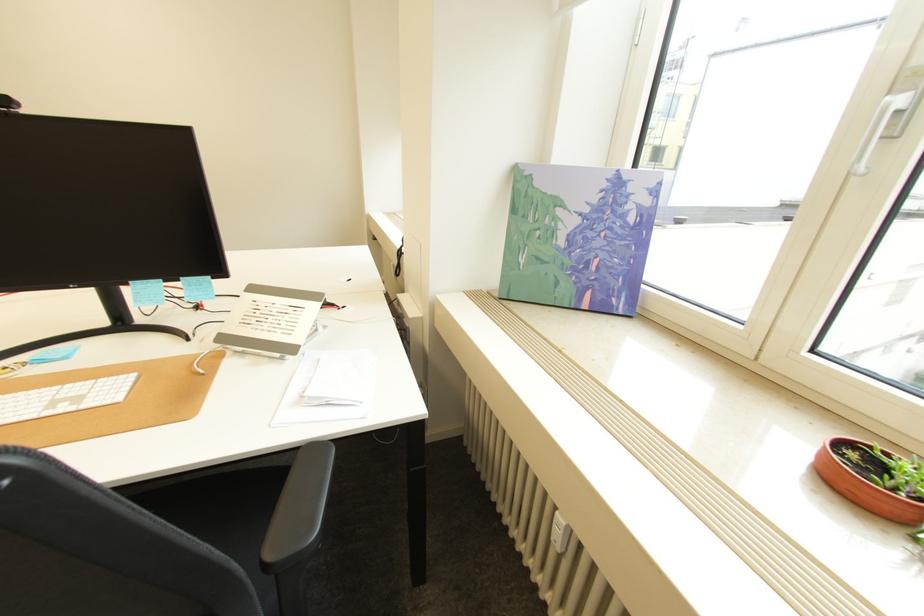
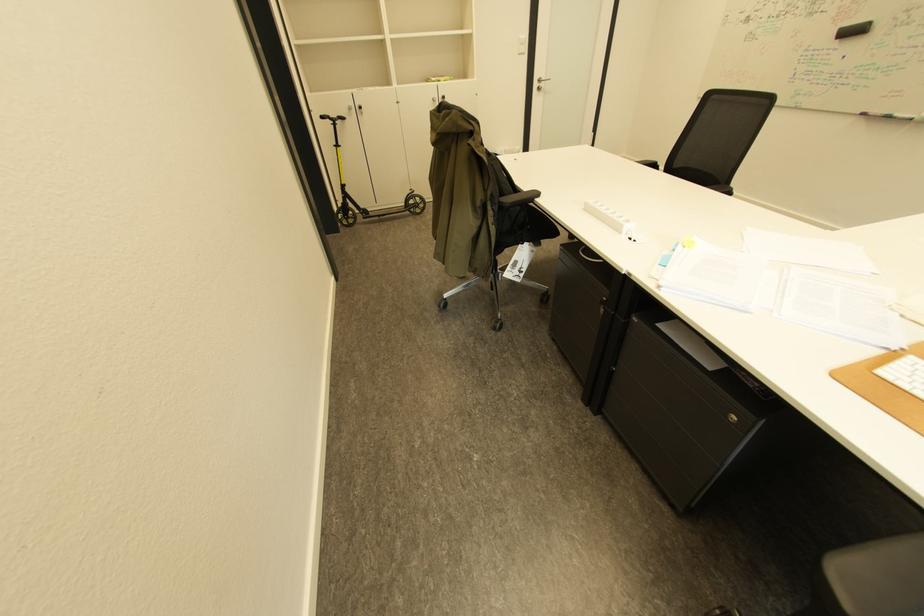
The first image is from the beginning of the video and the second image is from the end. How did the camera likely rotate when shooting the video?

The rotation direction of the camera is left-down.